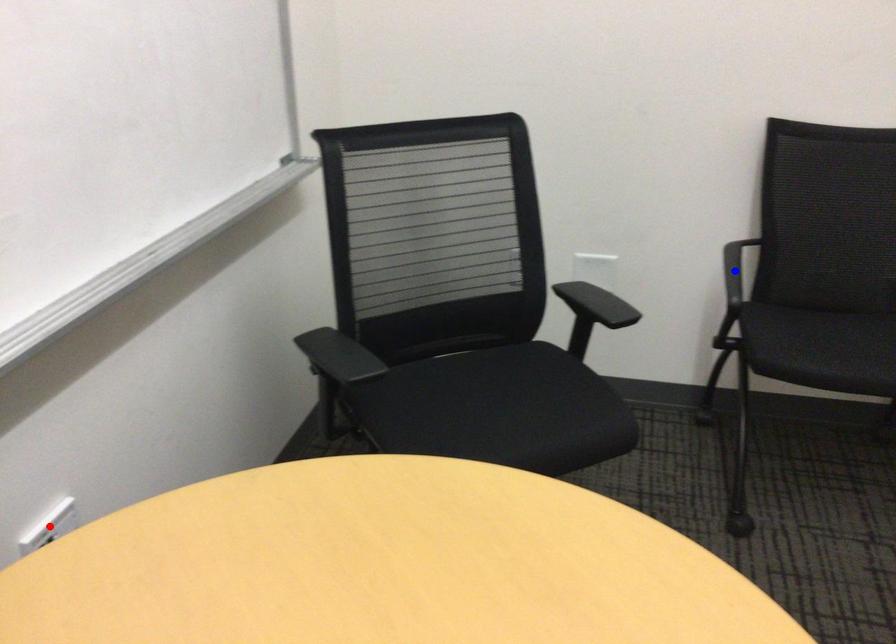
Question: Which of the two points in the image is closer to the camera?

Choices:
 (A) Blue point is closer.
 (B) Red point is closer.

Answer: (B)